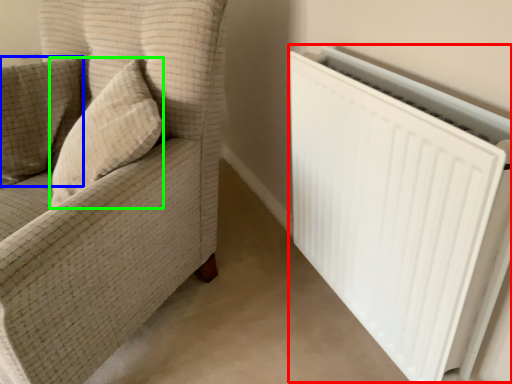
Question: Estimate the real-world distances between objects in this image. Which object is closer to radiator (highlighted by a red box), pillow (highlighted by a blue box) or throw pillow (highlighted by a green box)?

Choices:
 (A) pillow
 (B) throw pillow

Answer: (B)